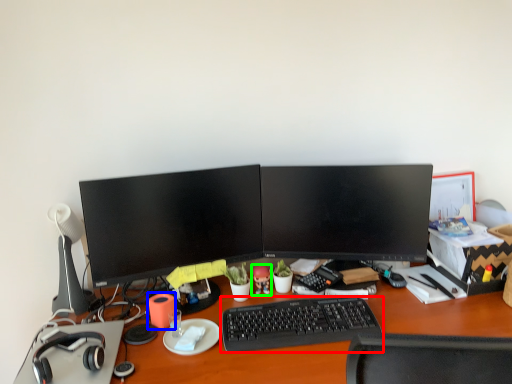
Question: Which object is the closest to the computer keyboard (highlighted by a red box)? Choose among these: stationery (highlighted by a blue box) or toy (highlighted by a green box).

Choices:
 (A) stationery
 (B) toy

Answer: (B)